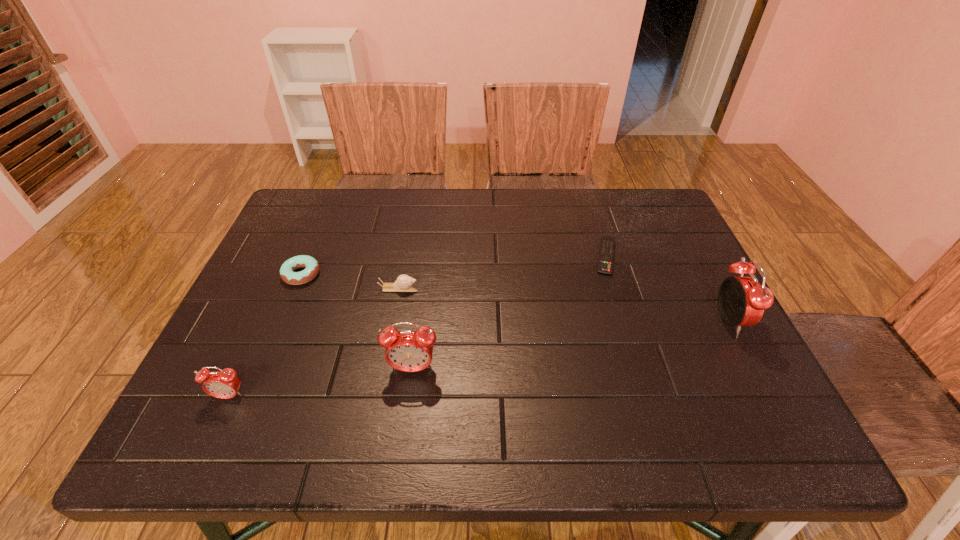
Where is `unoccupied area between the second shortest object and the farthest alarm clock`? This screenshot has height=540, width=960. unoccupied area between the second shortest object and the farthest alarm clock is located at coordinates (515, 298).

The height and width of the screenshot is (540, 960). Identify the location of blank region between the shortest object and the doughnut. (454, 265).

Identify which object is the second nearest to the remote control. Please provide its 2D coordinates. Your answer should be formatted as a tuple, i.e. [(x, y)], where the tuple contains the x and y coordinates of a point satisfying the conditions above.

[(403, 283)]

At what (x,y) coordinates should I click in order to perform the action: click on object that is the closest to the shortest alarm clock. Please return your answer as a coordinate pair (x, y). This screenshot has width=960, height=540. Looking at the image, I should click on (409, 351).

The width and height of the screenshot is (960, 540). I want to click on alarm clock that can be found as the closest to the doughnut, so click(224, 384).

Where is `alarm clock object that ranks as the second closest to the second alarm clock from left to right`? The image size is (960, 540). alarm clock object that ranks as the second closest to the second alarm clock from left to right is located at coordinates (742, 300).

You are a GUI agent. You are given a task and a screenshot of the screen. Output one action in this format:
    pyautogui.click(x=<x>, y=<y>)
    Task: Click on the free location that satisfies the following two spatial constraints: 1. on the shell of the escargot; 2. on the face of the third tallest object
    The image size is (960, 540).
    Given the screenshot: What is the action you would take?
    pyautogui.click(x=379, y=396)

The width and height of the screenshot is (960, 540). What are the coordinates of `free space that satisfies the following two spatial constraints: 1. on the face of the rightmost object; 2. on the face of the second tallest alarm clock` in the screenshot? It's located at (753, 369).